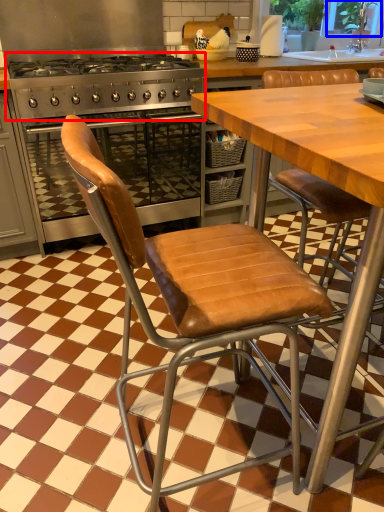
Question: Among these objects, which one is nearest to the camera, gas stove (highlighted by a red box) or window screen (highlighted by a blue box)?

Choices:
 (A) gas stove
 (B) window screen

Answer: (A)